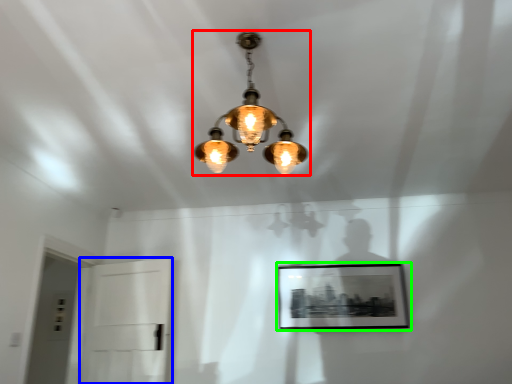
Question: Considering the real-world distances, which object is closest to lamp (highlighted by a red box)? glass door (highlighted by a blue box) or picture frame (highlighted by a green box).

Choices:
 (A) glass door
 (B) picture frame

Answer: (B)